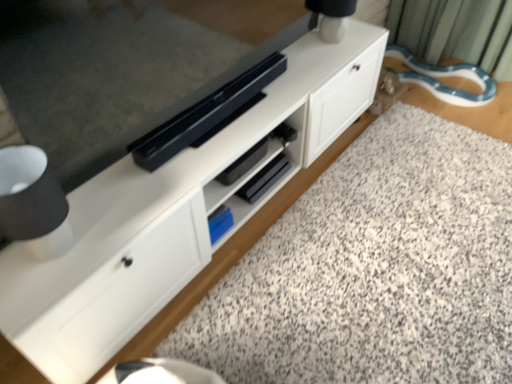
Question: From the image's perspective, is white matte cabinet at center above or below granite at lower center?

Choices:
 (A) below
 (B) above

Answer: (B)

Question: In terms of size, does white matte cabinet at center appear bigger or smaller than granite at lower center?

Choices:
 (A) small
 (B) big

Answer: (B)

Question: Estimate the real-world distances between objects in this image. Which object is farther from the granite at lower center?

Choices:
 (A) white matte cabinet at center
 (B) white matte table lamp at upper right

Answer: (B)

Question: Based on their relative distances, which object is nearer to the white matte table lamp at upper right?

Choices:
 (A) granite at lower center
 (B) white matte cabinet at center

Answer: (B)